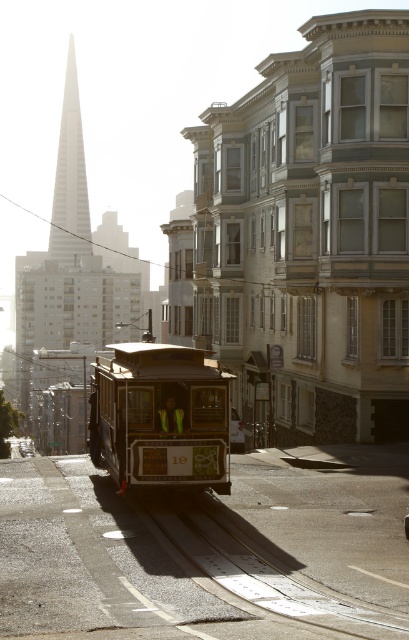
From the picture: Measure the distance between metal/smooth track at center and metallic silver car at center.

metal/smooth track at center and metallic silver car at center are 19.17 meters apart from each other.

Between metal/smooth track at center and metallic silver car at center, which one appears on the left side from the viewer's perspective?

Positioned to the left is metal/smooth track at center.

Who is more forward, (406,621) or (231,448)?

Point (406,621) is more forward.

I want to click on metal/smooth track at center, so click(x=256, y=568).

Is shiny brown cable car at center smaller than metal/smooth track at center?

Actually, shiny brown cable car at center might be larger than metal/smooth track at center.

Based on the photo, is shiny brown cable car at center taller than metal/smooth track at center?

Yes.

Between point (215, 484) and point (253, 573), which one is positioned in front?

Positioned in front is point (253, 573).

Image resolution: width=409 pixels, height=640 pixels. What are the coordinates of `shiny brown cable car at center` in the screenshot? It's located at pyautogui.click(x=161, y=417).

From the picture: How distant is white glass spire at upper center from metallic silver car at center?

white glass spire at upper center is 274.23 meters from metallic silver car at center.

Between point (53, 259) and point (238, 442), which one is positioned in front?

Point (238, 442) is more forward.

Find the location of a particular element. This screenshot has width=409, height=640. white glass spire at upper center is located at coordinates (69, 177).